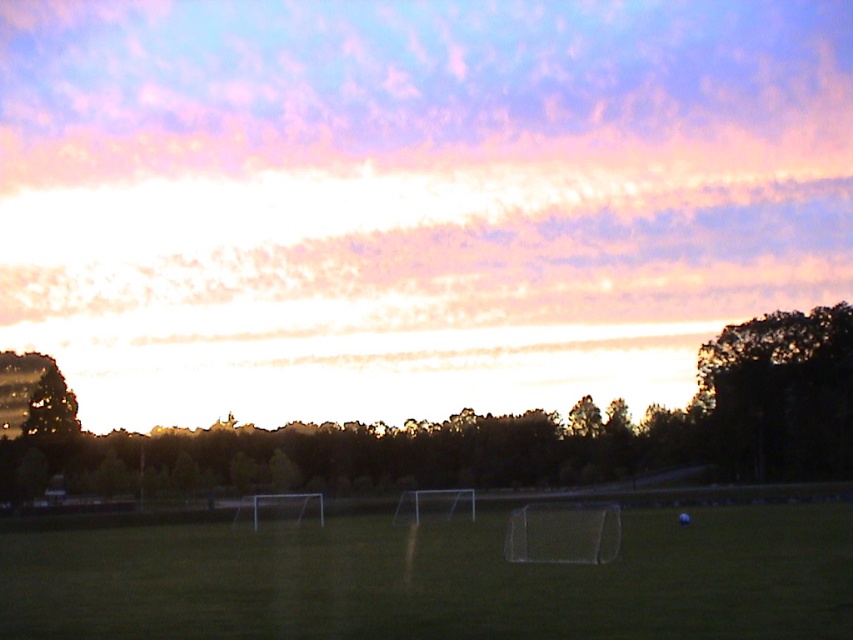
You are planning to set up a picnic blanket in the center of the grassy field. Given the size of the green grass at center and the dark green leafy tree at right, will there be enough space to place a standard picnic blanket without it overlapping with the tree?

The green grass at center has a larger size compared to the dark green leafy tree at right, so there should be enough space to place a standard picnic blanket without overlapping with the tree.

You are standing at the edge of the soccer field and want to walk directly to the dark green leafy tree at center. How far will you have to walk from the green grass at center?

The green grass at center is 39.56 meters away from the dark green leafy tree at center, so you will have to walk approximately 39.56 meters to reach the tree.